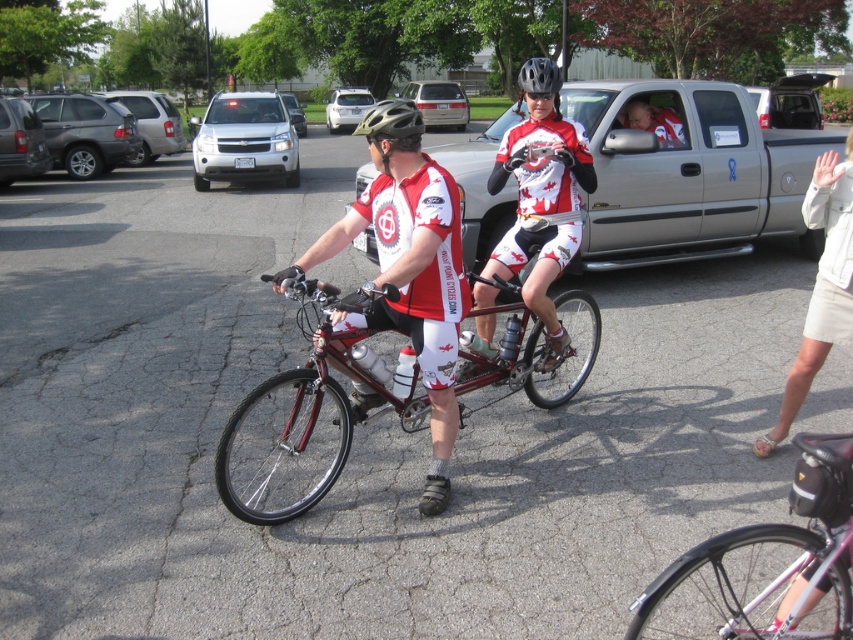
Is pink matte bicycle at lower right shorter than beige fabric skirt at lower right?

Yes, pink matte bicycle at lower right is shorter than beige fabric skirt at lower right.

Can you confirm if pink matte bicycle at lower right is positioned below beige fabric skirt at lower right?

Yes, pink matte bicycle at lower right is below beige fabric skirt at lower right.

Which is in front, point (701, 593) or point (778, 420)?

Point (701, 593)

Locate an element on the screen. The width and height of the screenshot is (853, 640). pink matte bicycle at lower right is located at coordinates (764, 564).

Who is positioned more to the right, pink matte bicycle at lower right or silver metallic suv at upper left?

Positioned to the right is pink matte bicycle at lower right.

Between pink matte bicycle at lower right and silver metallic suv at upper left, which one has less height?

pink matte bicycle at lower right is shorter.

Is point (630, 621) closer to camera compared to point (151, 141)?

Yes, point (630, 621) is in front of point (151, 141).

The width and height of the screenshot is (853, 640). What are the coordinates of `pink matte bicycle at lower right` in the screenshot? It's located at (764, 564).

Does silver metallic suv at upper center come in front of matte silver suv at upper left?

No, silver metallic suv at upper center is further to the viewer.

Can you confirm if silver metallic suv at upper center is positioned below matte silver suv at upper left?

No.

Locate an element on the screen. silver metallic suv at upper center is located at coordinates (244, 140).

I want to click on silver metallic suv at upper center, so click(244, 140).